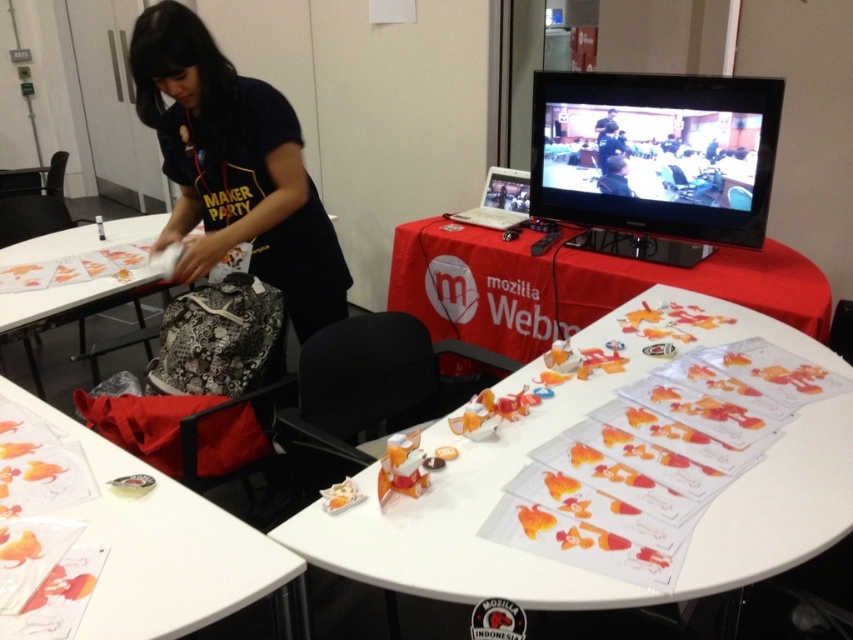
Question: Which object is closer to the camera taking this photo?

Choices:
 (A) white paper at left
 (B) red cloth at upper center
 (C) matte plastic table at lower left

Answer: (C)

Question: Does dark blue shirt at upper left have a greater width compared to matte black shirt at upper center?

Choices:
 (A) no
 (B) yes

Answer: (B)

Question: Which is nearer to the dark blue shirt at upper left?

Choices:
 (A) white paper at left
 (B) matte black shirt at upper center

Answer: (A)

Question: Can you confirm if white paper at center is positioned below white paper at left?

Choices:
 (A) yes
 (B) no

Answer: (A)

Question: Which object is the closest to the white paper at center?

Choices:
 (A) dark blue shirt at upper left
 (B) matte plastic table at lower left
 (C) matte black shirt at upper center
 (D) white paper at left

Answer: (B)

Question: From the image, what is the correct spatial relationship of white paper at left in relation to matte black shirt at upper center?

Choices:
 (A) above
 (B) below

Answer: (B)